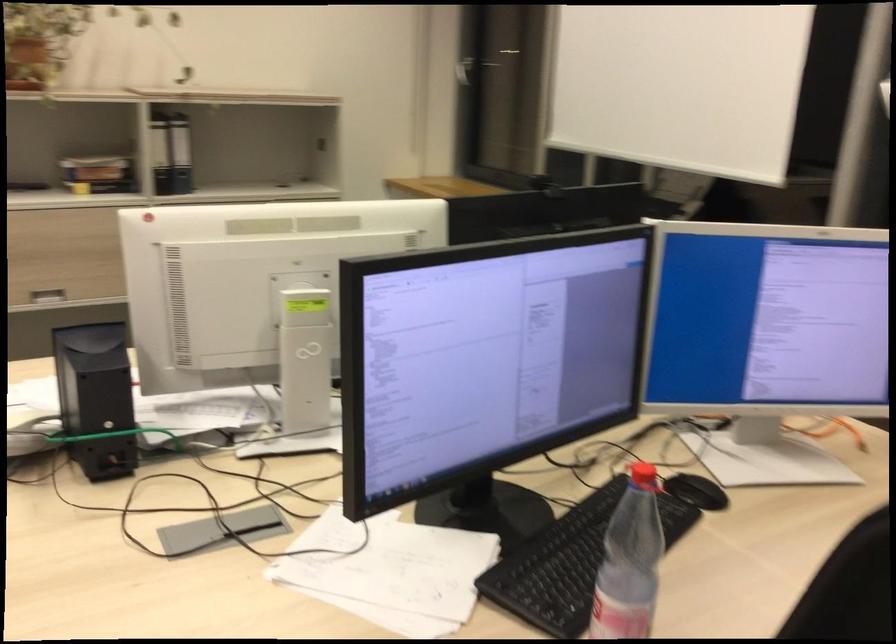
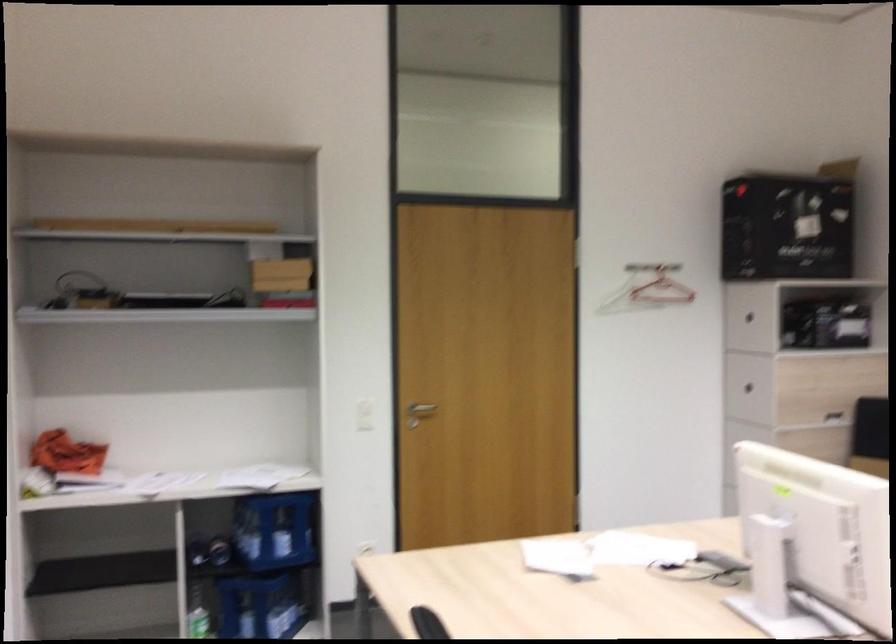
Question: The camera is either moving clockwise (left) or counter-clockwise (right) around the object. The first image is from the beginning of the video and the second image is from the end. Is the camera moving left or right when shooting the video?

Choices:
 (A) Left
 (B) Right

Answer: (B)